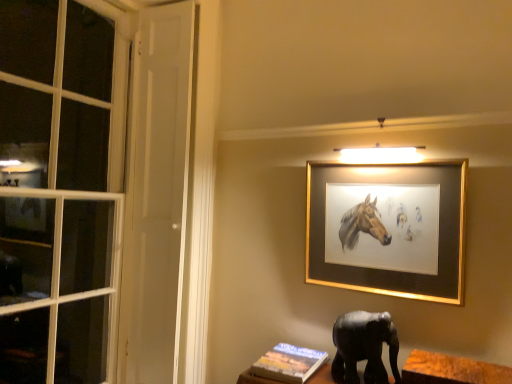
The width and height of the screenshot is (512, 384). Describe the element at coordinates (389, 230) in the screenshot. I see `gold-framed painting at upper center` at that location.

Describe the element at coordinates (288, 363) in the screenshot. I see `hardcover book at lower center` at that location.

Where is `black matte elephant at lower right`? black matte elephant at lower right is located at coordinates (364, 347).

Considering the relative sizes of black matte elephant at lower right and gold-framed painting at upper center in the image provided, is black matte elephant at lower right smaller than gold-framed painting at upper center?

Yes.

Is black matte elephant at lower right beside gold-framed painting at upper center?

No.

Image resolution: width=512 pixels, height=384 pixels. I want to click on picture frame behind the black matte elephant at lower right, so click(x=389, y=230).

Is black matte elephant at lower right facing towards gold-framed painting at upper center?

No.

Is hardcover book at lower center turned away from gold-framed painting at upper center?

No, hardcover book at lower center is not facing away from gold-framed painting at upper center.

The height and width of the screenshot is (384, 512). In order to click on picture frame above the hardcover book at lower center (from the image's perspective) in this screenshot , I will do `click(389, 230)`.

Does hardcover book at lower center have a larger size compared to gold-framed painting at upper center?

Actually, hardcover book at lower center might be smaller than gold-framed painting at upper center.

In the scene shown: From their relative heights in the image, would you say hardcover book at lower center is taller or shorter than wooden at lower right?

In the image, hardcover book at lower center appears to be shorter than wooden at lower right.

From a real-world perspective, is hardcover book at lower center positioned above or below wooden at lower right?

Clearly, from a real-world perspective, hardcover book at lower center is below wooden at lower right.

Is hardcover book at lower center behind wooden at lower right?

Yes, hardcover book at lower center is further from the camera.

From the image's perspective, is hardcover book at lower center above or below wooden at lower right?

hardcover book at lower center is situated lower than wooden at lower right in the image.

In the scene shown: Can you confirm if wooden at lower right is taller than black matte elephant at lower right?

In fact, wooden at lower right may be shorter than black matte elephant at lower right.

From a real-world perspective, which object rests below the other?

wooden at lower right, from a real-world perspective.

Between wooden at lower right and black matte elephant at lower right, which one appears on the left side from the viewer's perspective?

Positioned to the left is black matte elephant at lower right.

From the image's perspective, which object appears higher, gold-framed painting at upper center or hardcover book at lower center?

From the image's view, gold-framed painting at upper center is above.

Looking at this image, what's the angular difference between gold-framed painting at upper center and hardcover book at lower center's facing directions?

2.44 degrees separate the facing orientations of gold-framed painting at upper center and hardcover book at lower center.

In the image, is gold-framed painting at upper center positioned in front of or behind hardcover book at lower center?

Visually, gold-framed painting at upper center is located in front of hardcover book at lower center.

You are a GUI agent. You are given a task and a screenshot of the screen. Output one action in this format:
    pyautogui.click(x=<x>, y=<y>)
    Task: Click on the picture frame on the right of black matte elephant at lower right
    
    Given the screenshot: What is the action you would take?
    pyautogui.click(x=389, y=230)

Would you say gold-framed painting at upper center is outside black matte elephant at lower right?

gold-framed painting at upper center is positioned outside black matte elephant at lower right.

Between gold-framed painting at upper center and black matte elephant at lower right, which one has less height?

black matte elephant at lower right is shorter.

Is gold-framed painting at upper center in contact with black matte elephant at lower right?

No, gold-framed painting at upper center is not next to black matte elephant at lower right.

From a real-world perspective, between hardcover book at lower center and black matte elephant at lower right, who is vertically lower?

In real-world perspective, hardcover book at lower center is lower.

Is hardcover book at lower center not inside black matte elephant at lower right?

That's correct, hardcover book at lower center is outside of black matte elephant at lower right.

Considering the relative sizes of hardcover book at lower center and black matte elephant at lower right in the image provided, is hardcover book at lower center bigger than black matte elephant at lower right?

No.

Locate an element on the screen. This screenshot has width=512, height=384. elephant located underneath the gold-framed painting at upper center (from a real-world perspective) is located at coordinates click(x=364, y=347).

You are a GUI agent. You are given a task and a screenshot of the screen. Output one action in this format:
    pyautogui.click(x=<x>, y=<y>)
    Task: Click on the book on the left of gold-framed painting at upper center
    Image resolution: width=512 pixels, height=384 pixels.
    Given the screenshot: What is the action you would take?
    pyautogui.click(x=288, y=363)

Which object lies further to the anchor point gold-framed painting at upper center, black matte elephant at lower right or wooden at lower right?

Among the two, wooden at lower right is located further to gold-framed painting at upper center.

From the picture: Based on their spatial positions, is black matte elephant at lower right or gold-framed painting at upper center closer to wooden at lower right?

black matte elephant at lower right.

Looking at the image, which one is located further to gold-framed painting at upper center, wooden at lower right or hardcover book at lower center?

hardcover book at lower center lies further to gold-framed painting at upper center than the other object.

From the image, which object appears to be farther from hardcover book at lower center, black matte elephant at lower right or gold-framed painting at upper center?

gold-framed painting at upper center.

Considering their positions, is gold-framed painting at upper center positioned closer to black matte elephant at lower right than wooden at lower right?

The object closer to black matte elephant at lower right is wooden at lower right.

When comparing their distances from wooden at lower right, does gold-framed painting at upper center or black matte elephant at lower right seem further?

gold-framed painting at upper center is positioned further to the anchor wooden at lower right.

When comparing their distances from black matte elephant at lower right, does wooden at lower right or hardcover book at lower center seem further?

The object further to black matte elephant at lower right is hardcover book at lower center.

Looking at the image, which one is located closer to hardcover book at lower center, black matte elephant at lower right or wooden at lower right?

The object closer to hardcover book at lower center is black matte elephant at lower right.

I want to click on elephant between gold-framed painting at upper center and hardcover book at lower center vertically, so click(x=364, y=347).

In order to click on table between gold-framed painting at upper center and hardcover book at lower center in the vertical direction in this screenshot , I will do `click(451, 370)`.

At what (x,y) coordinates should I click in order to perform the action: click on elephant located between hardcover book at lower center and wooden at lower right in the left-right direction. Please return your answer as a coordinate pair (x, y). The width and height of the screenshot is (512, 384). Looking at the image, I should click on (364, 347).

Image resolution: width=512 pixels, height=384 pixels. Identify the location of elephant between gold-framed painting at upper center and wooden at lower right in the up-down direction. (364, 347).